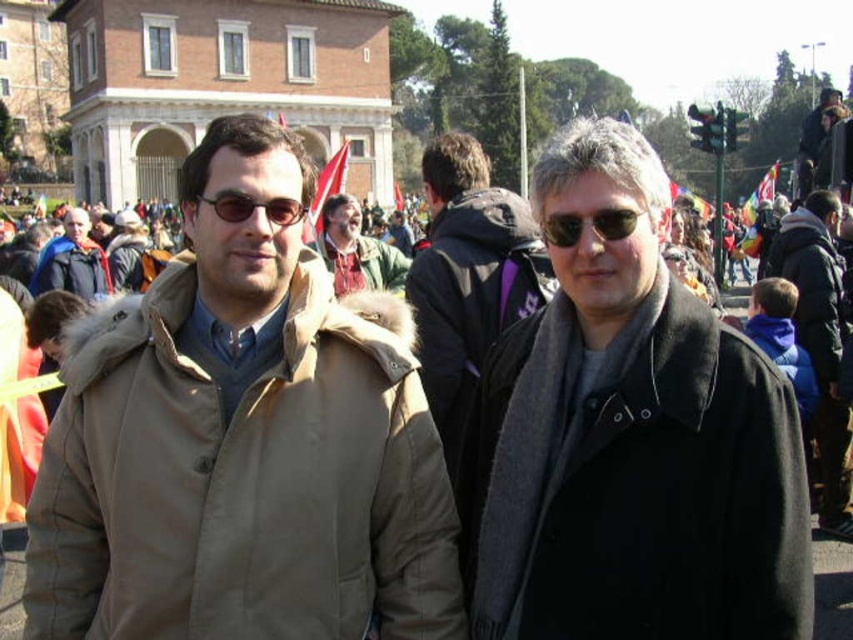
From the picture: You are a photographer trying to capture a photo of the blue fleece jacket at right and the sunglasses at center. If you want to ensure both items are fully visible in the frame without cropping, which object should you adjust your camera angle to prioritize based on their sizes?

The blue fleece jacket at right is wider than the sunglasses at center. To ensure both are fully visible, prioritize framing the larger blue fleece jacket at right first, then adjust to include the smaller sunglasses at center.

You are standing in the crowd at the event and want to locate the blue fleece jacket at right. According to the coordinates provided, where should you look?

The blue fleece jacket at right is located at coordinates point 0.536 on the x axis and 0.962 on the y axis.

Looking at this image, you are a photographer trying to capture a group photo of the tan fabric coat at left and the blue fleece jacket at right. If you want to ensure both are fully visible in the frame, which side should you position the wider object to avoid cropping?

The tan fabric coat at left is wider than the blue fleece jacket at right, so you should position the tan fabric coat at left on the side with more space to avoid cropping.